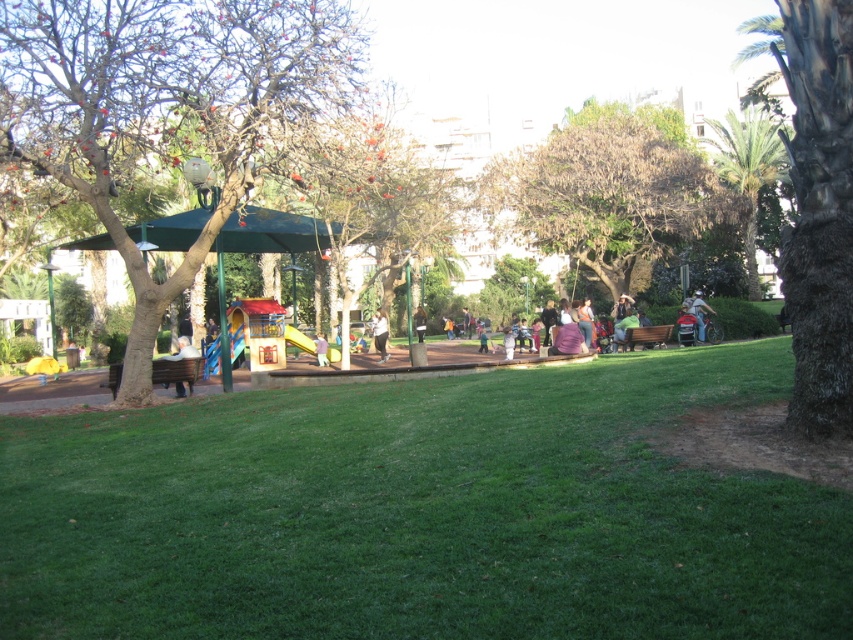
You are a photographer setting up a tripod in the park. You notice a person wearing light blue jeans at center and another wearing a brown leather jacket at center. Which clothing item is taller?

The light blue jeans at center is taller than the brown leather jacket at center.

You are planning to sit on the light brown wooden bench at left while watching someone wearing the white cotton shirt at center. Considering the size of the bench, do you think there is enough space for you to sit comfortably?

The light brown wooden bench at left is wider than the white cotton shirt at center, so there should be enough space for you to sit comfortably while watching the person in the white cotton shirt at center.